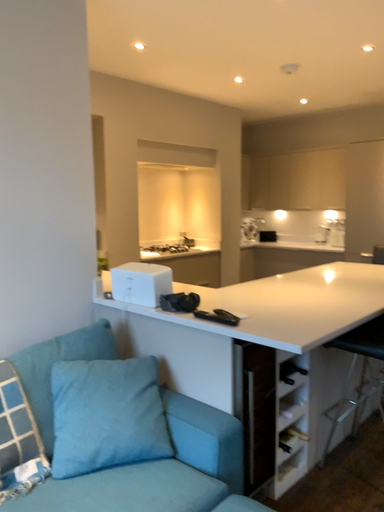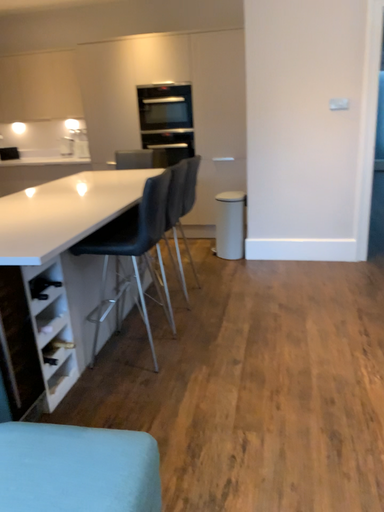
Question: Which way did the camera rotate in the video?

Choices:
 (A) rotated upward
 (B) rotated downward

Answer: (B)